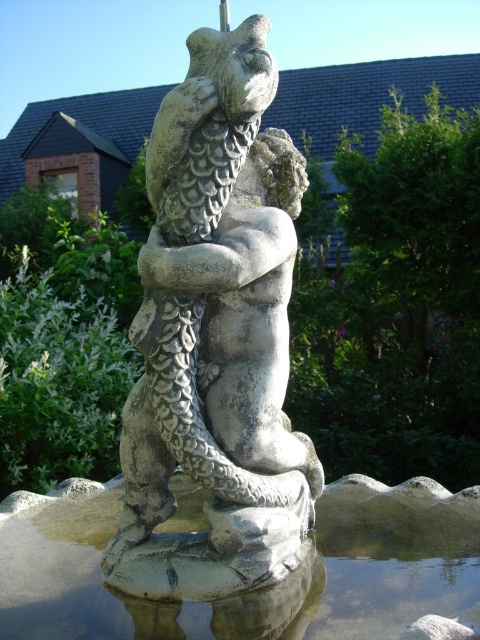
Between gray stone statue at center and clear stone water at center, which one appears on the right side from the viewer's perspective?

gray stone statue at center is more to the right.

Between gray stone statue at center and clear stone water at center, which one has more height?

gray stone statue at center

What do you see at coordinates (216, 339) in the screenshot? I see `gray stone statue at center` at bounding box center [216, 339].

Locate an element on the screen. gray stone statue at center is located at coordinates (216, 339).